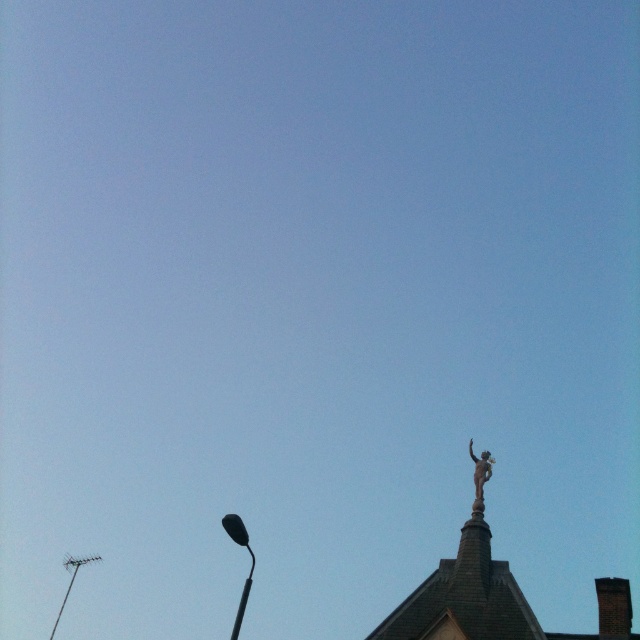
You are an architect designing a new city park and want to place two landmarks. The black glossy street light at lower left and the bronze statue at upper right must be positioned such that their widths are proportionate to their importance. Given that the street light is more important, does its current width in the image align with its importance?

Yes, the black glossy street light at lower left has a larger width than the bronze statue at upper right, which aligns with its higher importance as the more important landmark should be wider.

You are a photographer trying to capture both the bronze statue at upper right and the metallic streetlight at lower left in the same frame. Based on their sizes in the image, which object would you need to zoom in more to include fully in your photo?

The bronze statue at upper right is smaller than the metallic streetlight at lower left, so you would need to zoom in more to include the metallic streetlight at lower left fully in your photo.

You are a city planner analyzing this image. You need to determine if the black glossy street light at lower left can be seen from the base of the bronze statue at upper right. Consider their sizes and positions in the scene.

The black glossy street light at lower left has a larger size compared to bronze statue at upper right. Since the street light is larger and positioned lower in the frame, it is more likely to be visible from the base of the bronze statue at upper right.